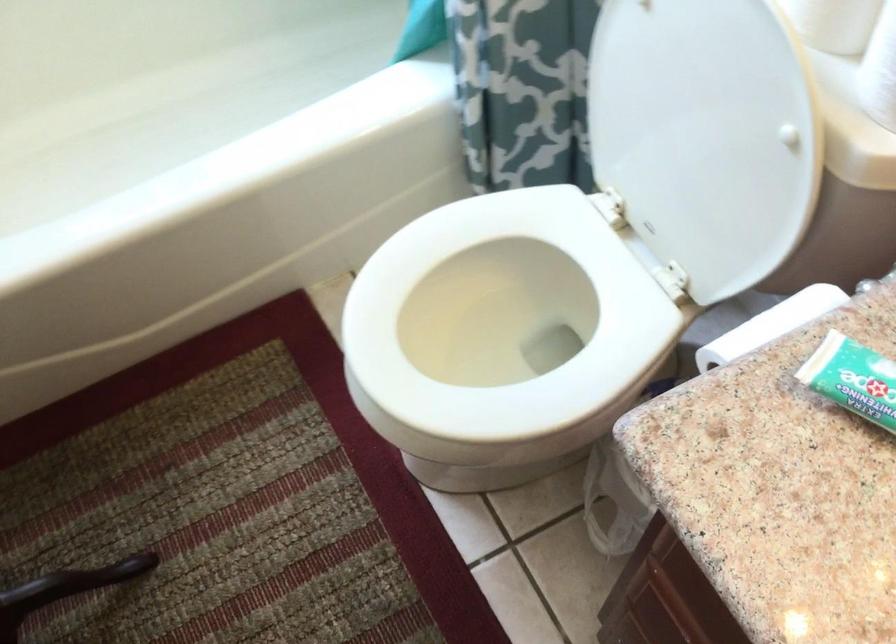
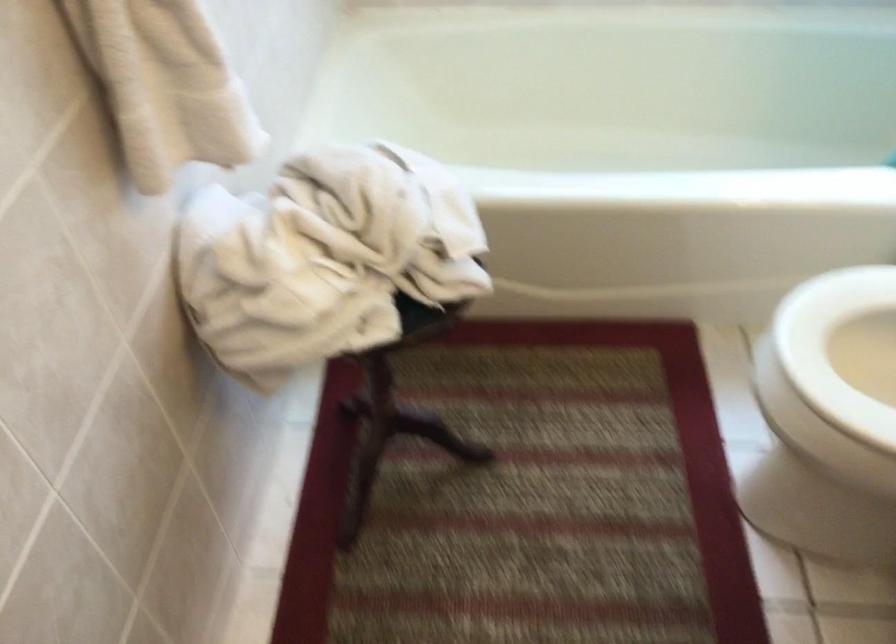
Question: The camera is either moving clockwise (left) or counter-clockwise (right) around the object. The first image is from the beginning of the video and the second image is from the end. Is the camera moving left or right when shooting the video?

Choices:
 (A) Left
 (B) Right

Answer: (B)